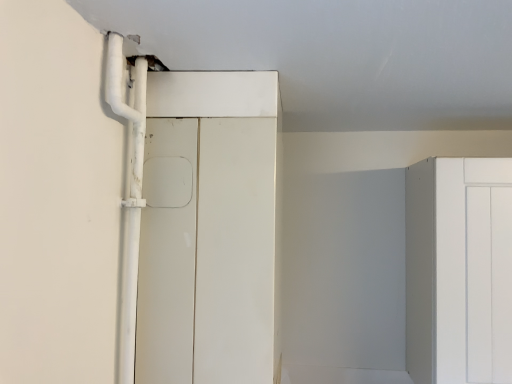
Question: From the image's perspective, is white plastic pipe at left above or below white matte door at center?

Choices:
 (A) below
 (B) above

Answer: (B)

Question: Looking at the image, does white plastic pipe at left seem bigger or smaller compared to white matte door at center?

Choices:
 (A) big
 (B) small

Answer: (B)

Question: Considering the positions of point (136, 195) and point (155, 367), is point (136, 195) closer or farther from the camera than point (155, 367)?

Choices:
 (A) farther
 (B) closer

Answer: (B)

Question: In terms of width, does white matte door at center look wider or thinner when compared to white plastic pipe at left?

Choices:
 (A) wide
 (B) thin

Answer: (A)

Question: Is point (238, 286) positioned closer to the camera than point (128, 97)?

Choices:
 (A) farther
 (B) closer

Answer: (A)

Question: In terms of height, does white matte door at center look taller or shorter compared to white plastic pipe at left?

Choices:
 (A) tall
 (B) short

Answer: (A)

Question: Would you say white matte door at center is inside or outside white plastic pipe at left?

Choices:
 (A) outside
 (B) inside

Answer: (A)